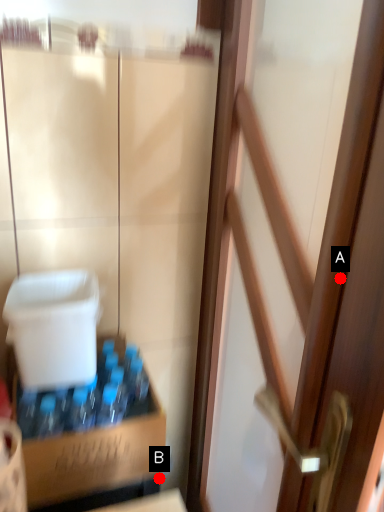
Question: Two points are circled on the image, labeled by A and B beside each circle. Which point appears closest to the camera in this image?

Choices:
 (A) A is closer
 (B) B is closer

Answer: (A)